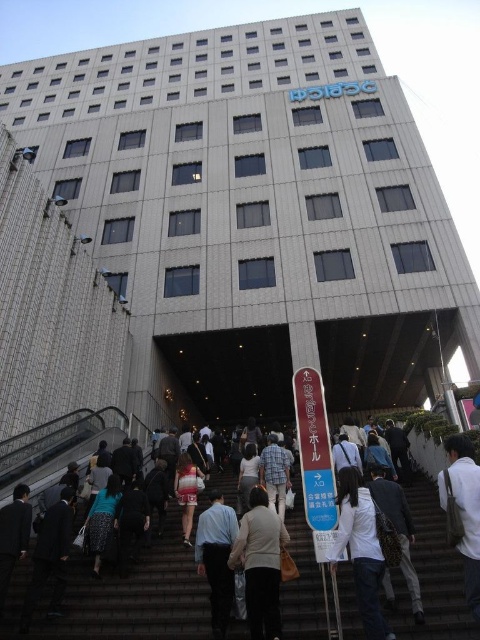
Can you confirm if white matte shirt at center is taller than white fabric bag at lower right?

Yes, white matte shirt at center is taller than white fabric bag at lower right.

Who is more forward, (358, 480) or (471, 474)?

Positioned in front is point (471, 474).

Where is `white matte shirt at center`? white matte shirt at center is located at coordinates (360, 548).

Is gray concrete stairs at center further to camera compared to white matte shirt at center?

Yes.

In the scene shown: Can you confirm if gray concrete stairs at center is shorter than white matte shirt at center?

Yes.

Image resolution: width=480 pixels, height=640 pixels. Find the location of `gray concrete stairs at center`. gray concrete stairs at center is located at coordinates (133, 596).

Locate an element on the screen. The width and height of the screenshot is (480, 640). gray concrete stairs at center is located at coordinates (133, 596).

Between gray concrete stairs at center and white fabric bag at lower right, which one is positioned lower?

gray concrete stairs at center is below.

Who is positioned more to the left, gray concrete stairs at center or white fabric bag at lower right?

gray concrete stairs at center is more to the left.

The height and width of the screenshot is (640, 480). What do you see at coordinates (133, 596) in the screenshot? I see `gray concrete stairs at center` at bounding box center [133, 596].

You are a GUI agent. You are given a task and a screenshot of the screen. Output one action in this format:
    pyautogui.click(x=<x>, y=<y>)
    Task: Click on the gray concrete stairs at center
    
    Given the screenshot: What is the action you would take?
    pyautogui.click(x=133, y=596)